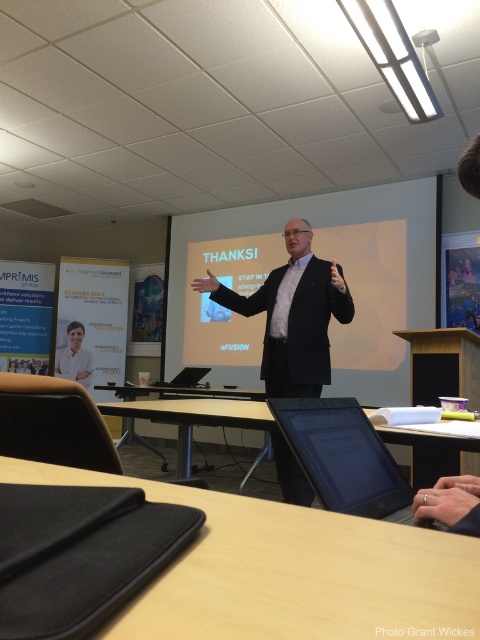
Question: Which point is closer to the camera?

Choices:
 (A) (419, 499)
 (B) (335, 595)
 (C) (387, 438)
 (D) (187, 381)

Answer: (B)

Question: Based on their relative distances, which object is nearer to the brown wooden table at center?

Choices:
 (A) black matte screen at lower center
 (B) black plastic table at lower center
 (C) black smooth suit at center
 (D) silver metallic ring at lower center

Answer: (A)

Question: Which point appears closest to the camera in this image?

Choices:
 (A) (422, 248)
 (B) (443, 518)

Answer: (B)

Question: Can you confirm if brown wooden table at center is positioned to the left of matte white shirt at left?

Choices:
 (A) no
 (B) yes

Answer: (A)

Question: Does white matte projection screen at center have a smaller size compared to black smooth suit at center?

Choices:
 (A) yes
 (B) no

Answer: (B)

Question: Does black smooth suit at center appear over brown wooden table at center?

Choices:
 (A) yes
 (B) no

Answer: (A)